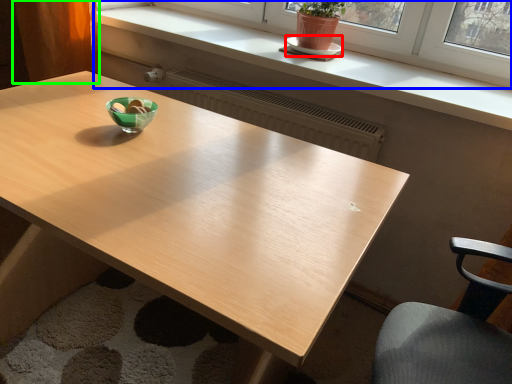
Question: Based on their relative distances, which object is nearer to saucer (highlighted by a red box)? Choose from window (highlighted by a blue box) and curtain (highlighted by a green box).

Choices:
 (A) window
 (B) curtain

Answer: (A)